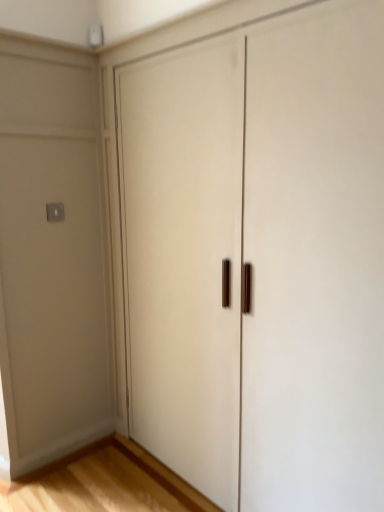
What do you see at coordinates (259, 258) in the screenshot? I see `white matte door at center` at bounding box center [259, 258].

Consider the image. In order to face white matte door at center, should I rotate leftwards or rightwards?

To align with it, rotate right about 12.402°.

Where is `white matte door at center`? white matte door at center is located at coordinates (259, 258).

The image size is (384, 512). I want to click on white matte door at center, so (259, 258).